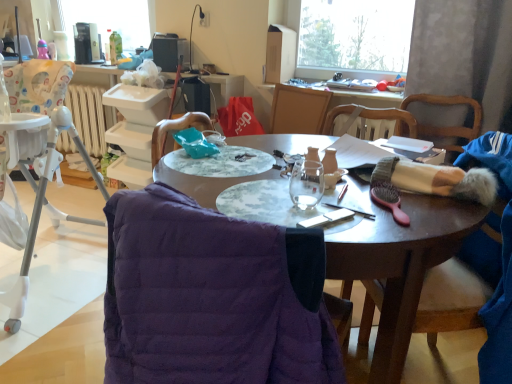
Question: Can you confirm if white plastic radiator at left is smaller than matte purple jacket at lower left?

Choices:
 (A) yes
 (B) no

Answer: (A)

Question: Considering the relative sizes of white plastic radiator at left and matte purple jacket at lower left in the image provided, is white plastic radiator at left thinner than matte purple jacket at lower left?

Choices:
 (A) no
 (B) yes

Answer: (B)

Question: From a real-world perspective, is white plastic radiator at left located beneath matte purple jacket at lower left?

Choices:
 (A) no
 (B) yes

Answer: (A)

Question: Is white plastic radiator at left turned away from matte purple jacket at lower left?

Choices:
 (A) no
 (B) yes

Answer: (A)

Question: Can you confirm if white plastic radiator at left is wider than matte purple jacket at lower left?

Choices:
 (A) no
 (B) yes

Answer: (A)

Question: Is point (65, 152) positioned closer to the camera than point (362, 215)?

Choices:
 (A) farther
 (B) closer

Answer: (A)

Question: In terms of size, does white plastic radiator at left appear bigger or smaller than black plastic pen at center?

Choices:
 (A) big
 (B) small

Answer: (A)

Question: Looking at their shapes, would you say white plastic radiator at left is wider or thinner than black plastic pen at center?

Choices:
 (A) thin
 (B) wide

Answer: (B)

Question: Do you think white plastic radiator at left is within black plastic pen at center, or outside of it?

Choices:
 (A) outside
 (B) inside

Answer: (A)

Question: From a real-world perspective, is wooden chair at right, the 1th chair in the right-to-left sequence, above or below white plastic radiator at left?

Choices:
 (A) below
 (B) above

Answer: (B)

Question: Would you say wooden chair at right, the 1th chair in the right-to-left sequence, is inside or outside white plastic radiator at left?

Choices:
 (A) outside
 (B) inside

Answer: (A)

Question: From their relative heights in the image, would you say wooden chair at right, the 1th chair in the right-to-left sequence, is taller or shorter than white plastic radiator at left?

Choices:
 (A) short
 (B) tall

Answer: (B)

Question: Is wooden chair at right, the 1th chair in the right-to-left sequence, to the left or to the right of white plastic radiator at left in the image?

Choices:
 (A) right
 (B) left

Answer: (A)

Question: Is white plastic highchair at left bigger or smaller than matte purple jacket at lower left?

Choices:
 (A) big
 (B) small

Answer: (B)

Question: Is white plastic highchair at left situated inside matte purple jacket at lower left or outside?

Choices:
 (A) inside
 (B) outside

Answer: (B)